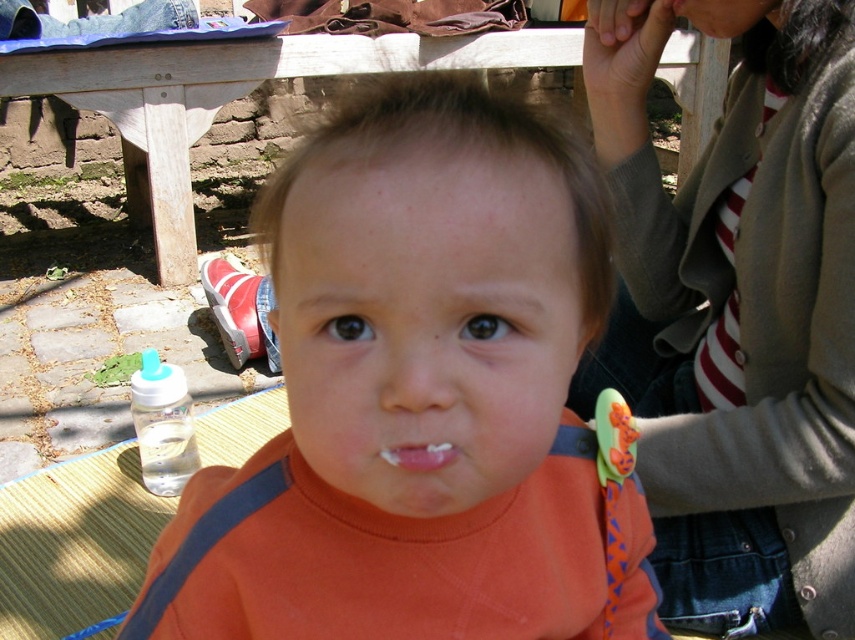
You are a parent who just arrived at the park with your child. You need to place the clear plastic bottle at lower left on the wooden picnic table at center. Can you do this without moving any other items on the table?

The wooden picnic table at center and clear plastic bottle at lower left are 6.01 feet apart from each other. Since the distance between them is greater than the typical reach of an adult, you may need to move closer or have assistance to place the bottle on the table.

You are standing in front of the wooden table and want to place a small toy between the two points marked as point (38,77) and point (142,417). Which point should you place the toy closer to so that it is in front of the wooden table?

You should place the toy closer to point (142,417) because point (38,77) is behind point (142,417), so placing it near the front point ensures it is in front of the wooden table.

You are helping set up for a picnic and need to decide where to place the striped fabric tie at upper right and the wooden picnic table at center. Based on their sizes, which item should be placed first to ensure proper arrangement?

The striped fabric tie at upper right is smaller than the wooden picnic table at center, so you should place the wooden picnic table at center first as it is larger and requires more space for positioning before arranging smaller items like the striped fabric tie at upper right.